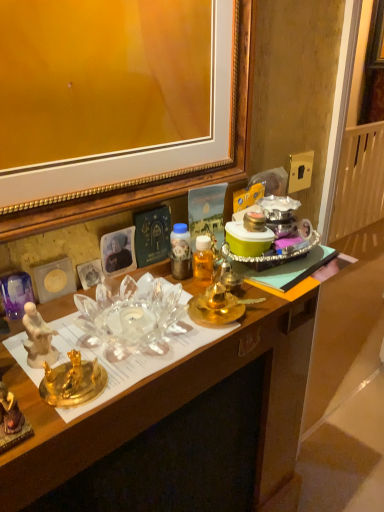
Image resolution: width=384 pixels, height=512 pixels. Identify the location of white porcelain plate at left. (16, 293).

This screenshot has height=512, width=384. What do you see at coordinates (16, 293) in the screenshot? I see `white porcelain plate at left` at bounding box center [16, 293].

What do you see at coordinates (299, 170) in the screenshot? The image size is (384, 512). I see `gold metallic power outlet at upper right` at bounding box center [299, 170].

Where is `white porcelain plate at left`? white porcelain plate at left is located at coordinates (16, 293).

Is gold metallic power outlet at upper right next to white porcelain plate at left and touching it?

There is a gap between gold metallic power outlet at upper right and white porcelain plate at left.

Considering the relative sizes of gold metallic power outlet at upper right and white porcelain plate at left in the image provided, is gold metallic power outlet at upper right thinner than white porcelain plate at left?

Yes, gold metallic power outlet at upper right is thinner than white porcelain plate at left.

How many degrees apart are the facing directions of gold metallic power outlet at upper right and white porcelain plate at left?

The angular difference between gold metallic power outlet at upper right and white porcelain plate at left is 6.15 degrees.

Do you think gold metallic power outlet at upper right is within white porcelain plate at left, or outside of it?

gold metallic power outlet at upper right exists outside the volume of white porcelain plate at left.

From a real-world perspective, is white porcelain plate at left physically below transparent glass bowl at center?

No, from a real-world perspective, white porcelain plate at left is not beneath transparent glass bowl at center.

From the image's perspective, would you say white porcelain plate at left is shown under transparent glass bowl at center?

Actually, white porcelain plate at left appears above transparent glass bowl at center in the image.

Could you tell me if white porcelain plate at left is turned towards transparent glass bowl at center?

No, white porcelain plate at left is not turned towards transparent glass bowl at center.

From the picture: Considering the positions of objects gold metallic power outlet at upper right and transparent glass bowl at center in the image provided, who is more to the left, gold metallic power outlet at upper right or transparent glass bowl at center?

From the viewer's perspective, transparent glass bowl at center appears more on the left side.

Is gold metallic power outlet at upper right further to camera compared to transparent glass bowl at center?

Yes, gold metallic power outlet at upper right is further from the viewer.

In order to click on desk that is under the gold metallic power outlet at upper right (from a real-world perspective) in this screenshot , I will do `click(179, 413)`.

Can you confirm if gold metallic power outlet at upper right is taller than transparent glass bowl at center?

In fact, gold metallic power outlet at upper right may be shorter than transparent glass bowl at center.

Is white porcelain plate at left facing away from gold metallic power outlet at upper right?

white porcelain plate at left does not have its back to gold metallic power outlet at upper right.

In the image, is white porcelain plate at left on the left side or the right side of gold metallic power outlet at upper right?

From the image, it's evident that white porcelain plate at left is to the left of gold metallic power outlet at upper right.

Is white porcelain plate at left next to gold metallic power outlet at upper right and touching it?

white porcelain plate at left and gold metallic power outlet at upper right are clearly separated.

Who is shorter, white porcelain plate at left or gold metallic power outlet at upper right?

gold metallic power outlet at upper right.

Which is in front, transparent glass bowl at center or white porcelain plate at left?

transparent glass bowl at center is more forward.

Is transparent glass bowl at center situated inside white porcelain plate at left or outside?

transparent glass bowl at center is not inside white porcelain plate at left, it's outside.

Between transparent glass bowl at center and white porcelain plate at left, which one appears on the left side from the viewer's perspective?

white porcelain plate at left is more to the left.

What's the angular difference between transparent glass bowl at center and gold metallic power outlet at upper right's facing directions?

They differ by 4.71 degrees in their facing directions.

From a real-world perspective, between transparent glass bowl at center and gold metallic power outlet at upper right, who is vertically higher?

gold metallic power outlet at upper right is physically above.

Is transparent glass bowl at center taller or shorter than gold metallic power outlet at upper right?

In the image, transparent glass bowl at center appears to be taller than gold metallic power outlet at upper right.

Is transparent glass bowl at center facing towards gold metallic power outlet at upper right?

No.

Where is `power outlet behind the white porcelain plate at left`? This screenshot has width=384, height=512. power outlet behind the white porcelain plate at left is located at coordinates (299, 170).

This screenshot has width=384, height=512. I want to click on desk below the white porcelain plate at left (from a real-world perspective), so click(179, 413).

Considering their positions, is white porcelain plate at left positioned further to transparent glass bowl at center than gold metallic power outlet at upper right?

Among the two, gold metallic power outlet at upper right is located further to transparent glass bowl at center.

When comparing their distances from gold metallic power outlet at upper right, does white porcelain plate at left or transparent glass bowl at center seem further?

white porcelain plate at left is positioned further to the anchor gold metallic power outlet at upper right.

Estimate the real-world distances between objects in this image. Which object is closer to white porcelain plate at left, transparent glass bowl at center or gold metallic power outlet at upper right?

transparent glass bowl at center is positioned closer to the anchor white porcelain plate at left.

Considering their positions, is gold metallic power outlet at upper right positioned further to transparent glass bowl at center than white porcelain plate at left?

Among the two, gold metallic power outlet at upper right is located further to transparent glass bowl at center.

Looking at the image, which one is located further to gold metallic power outlet at upper right, transparent glass bowl at center or white porcelain plate at left?

Based on the image, white porcelain plate at left appears to be further to gold metallic power outlet at upper right.

Considering their positions, is gold metallic power outlet at upper right positioned further to white porcelain plate at left than transparent glass bowl at center?

gold metallic power outlet at upper right is positioned further to the anchor white porcelain plate at left.

This screenshot has width=384, height=512. Find the location of `plate between gold metallic power outlet at upper right and transparent glass bowl at center from top to bottom`. plate between gold metallic power outlet at upper right and transparent glass bowl at center from top to bottom is located at coordinates (16, 293).